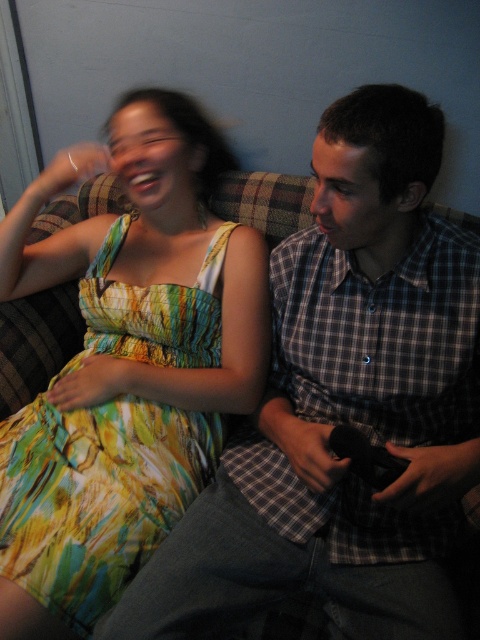
Does plaid shirt at center appear under printed fabric dress at left?

No.

Locate an element on the screen. Image resolution: width=480 pixels, height=640 pixels. plaid shirt at center is located at coordinates (344, 406).

I want to click on plaid shirt at center, so pos(344,406).